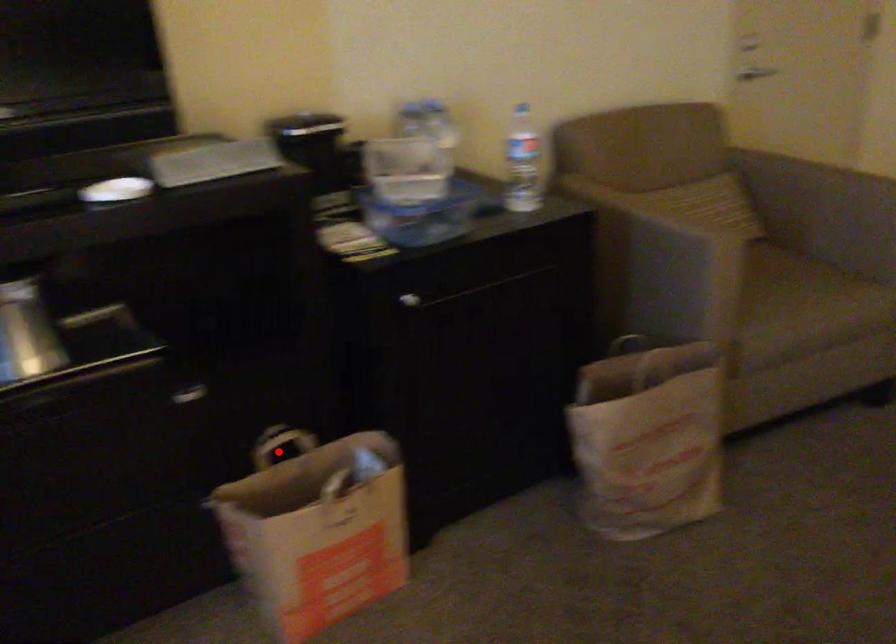
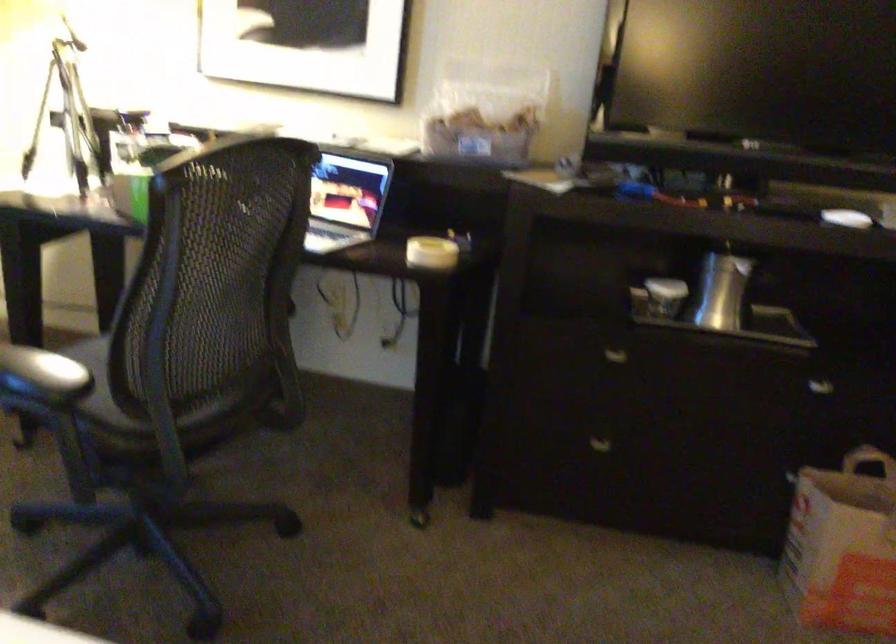
Locate, in the second image, the point that corresponds to the highlighted location in the first image.

(867, 460)